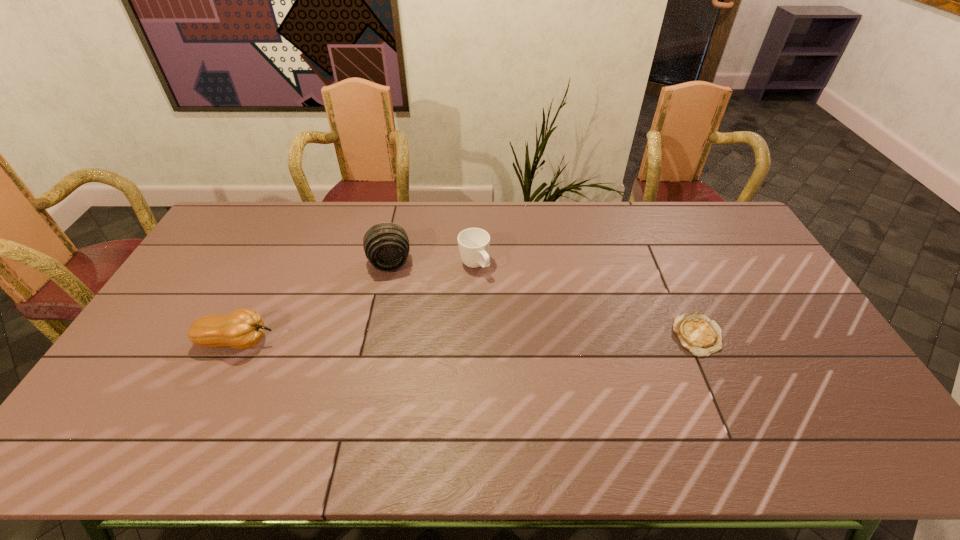
Identify the location of free area in between the third object from left to right and the leftmost object. This screenshot has height=540, width=960. (356, 303).

Identify the location of unoccupied area between the gourd and the cup. Image resolution: width=960 pixels, height=540 pixels. (356, 303).

This screenshot has width=960, height=540. I want to click on vacant area that lies between the rightmost object and the gourd, so click(468, 339).

Locate an element on the screen. This screenshot has height=540, width=960. unoccupied area between the second object from right to left and the third object from right to left is located at coordinates (432, 265).

Image resolution: width=960 pixels, height=540 pixels. I want to click on vacant space that's between the rightmost object and the second object from left to right, so click(543, 300).

The height and width of the screenshot is (540, 960). I want to click on vacant space that's between the leftmost object and the third object from left to right, so click(x=356, y=303).

The image size is (960, 540). I want to click on free point between the telephoto lens and the rightmost object, so click(543, 300).

Where is `vacant area that lies between the leftmost object and the quiche`? vacant area that lies between the leftmost object and the quiche is located at coordinates (468, 339).

I want to click on unoccupied area between the rightmost object and the gourd, so click(x=468, y=339).

Choose which object is the third nearest neighbor to the third object from left to right. Please provide its 2D coordinates. Your answer should be formatted as a tuple, i.e. [(x, y)], where the tuple contains the x and y coordinates of a point satisfying the conditions above.

[(696, 333)]